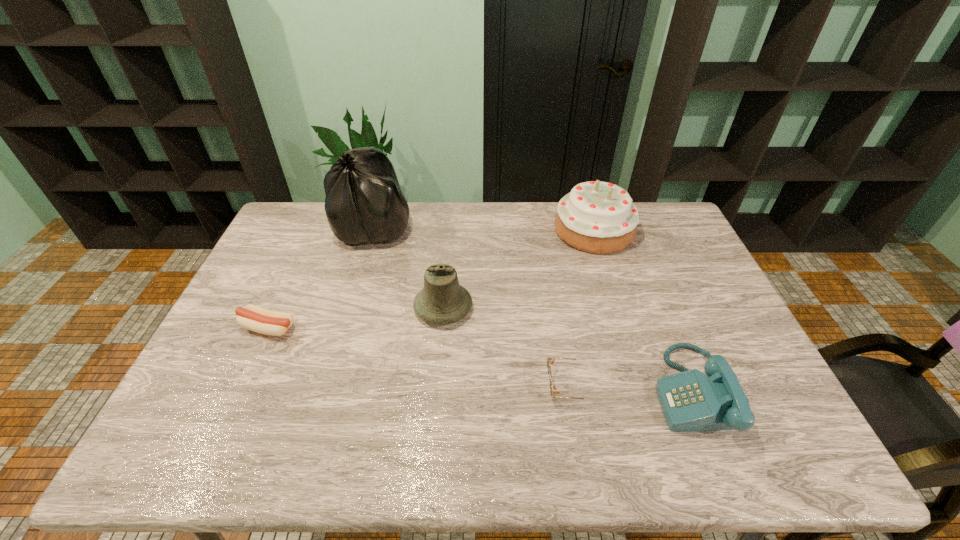
Identify the location of vacant region between the bell and the telephone. The width and height of the screenshot is (960, 540). (567, 349).

Image resolution: width=960 pixels, height=540 pixels. Find the location of `vacant space that's between the third object from left to right and the sunglasses`. vacant space that's between the third object from left to right and the sunglasses is located at coordinates (506, 347).

At what (x,y) coordinates should I click in order to perform the action: click on empty location between the third tallest object and the plastic bag. Please return your answer as a coordinate pair (x, y). The height and width of the screenshot is (540, 960). Looking at the image, I should click on (409, 267).

At what (x,y) coordinates should I click in order to perform the action: click on blank region between the sunglasses and the cake. Please return your answer as a coordinate pair (x, y). Looking at the image, I should click on (581, 308).

Find the location of `vacant area that lies between the fourth shortest object and the plastic bag`. vacant area that lies between the fourth shortest object and the plastic bag is located at coordinates (409, 267).

Identify the location of object that is the second nearest to the fourth tallest object. (596, 217).

Choose which object is the fifth nearest neighbor to the plastic bag. Please provide its 2D coordinates. Your answer should be formatted as a tuple, i.e. [(x, y)], where the tuple contains the x and y coordinates of a point satisfying the conditions above.

[(690, 400)]